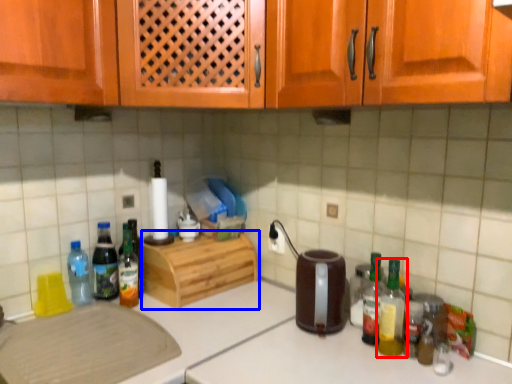
Question: Which object is closer to the camera taking this photo, bottle (highlighted by a red box) or cabinetry (highlighted by a blue box)?

Choices:
 (A) bottle
 (B) cabinetry

Answer: (A)